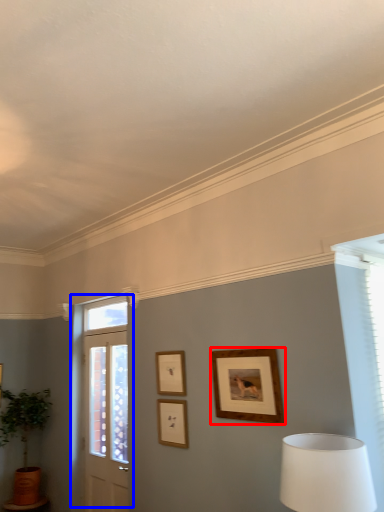
Question: Which object appears farthest to the camera in this image, picture frame (highlighted by a red box) or door (highlighted by a blue box)?

Choices:
 (A) picture frame
 (B) door

Answer: (B)